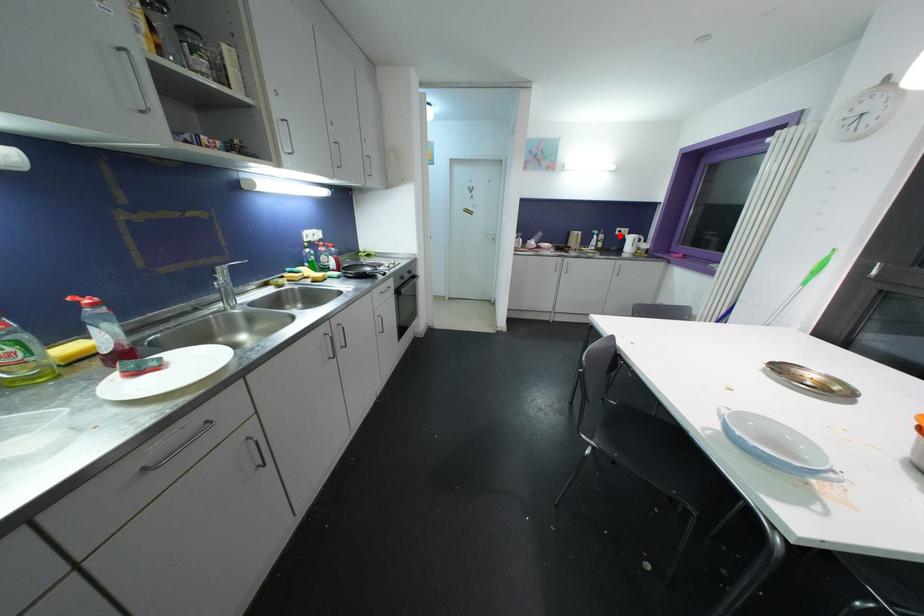
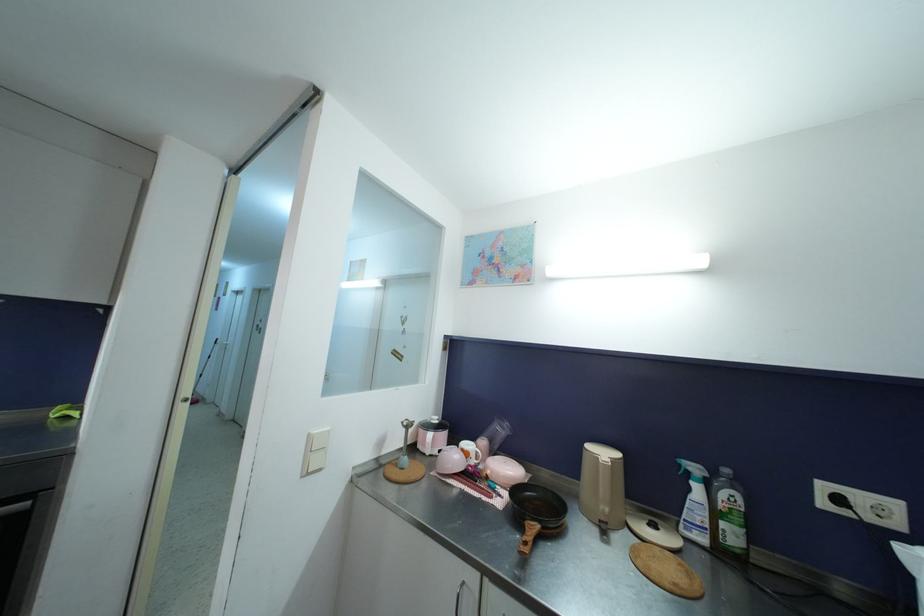
Question: I am providing you with two images of the same scene from different viewpoints. A red point is shown in image1. For the corresponding object point in image2, is it positioned nearer or farther from the camera?

Choices:
 (A) Nearer
 (B) Farther

Answer: (B)